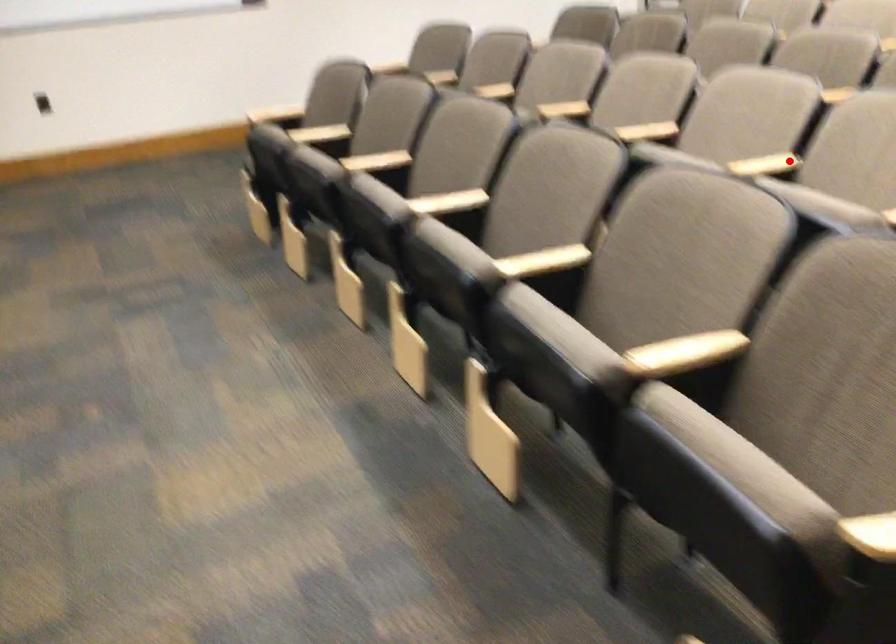
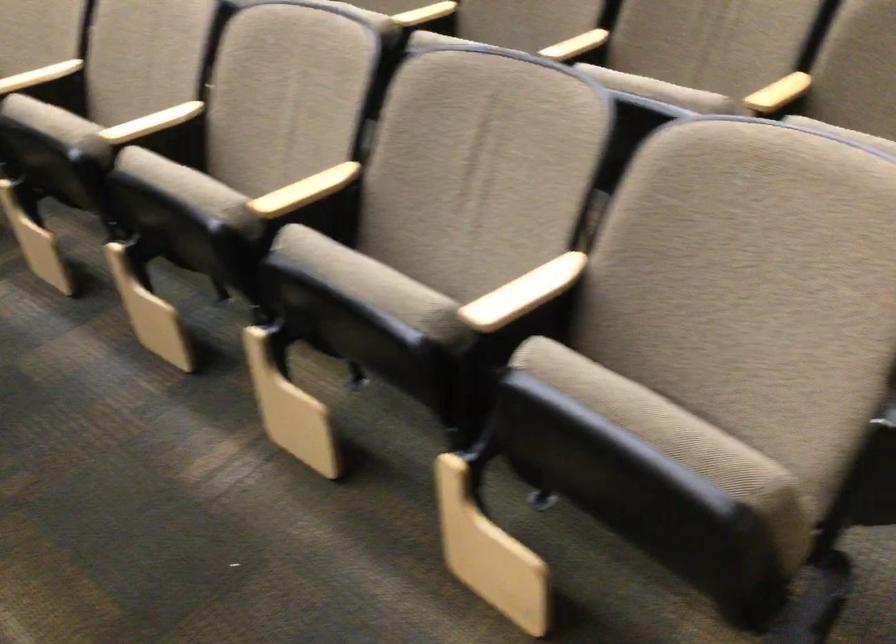
Locate, in the second image, the point that corresponds to the highlighted location in the first image.

(39, 76)